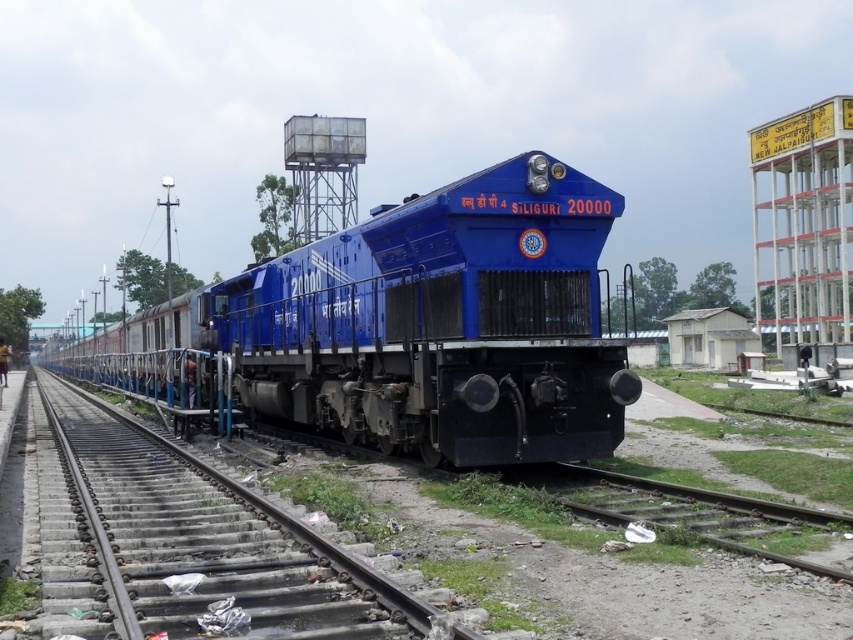
You are a maintenance worker tasked with inspecting the blue metallic locomotive at center and the smooth metal train track at center. The safety protocol requires that the distance between them must be at least 3 meters to ensure safe access. Can you confirm if the current distance meets the safety requirement?

The distance between the blue metallic locomotive at center and the smooth metal train track at center is 4.03 meters, which exceeds the required 3 meters, so it meets the safety requirement.

You are standing at the point marked as point [440,323] in the image. What object are you directly facing?

The point [440,323] indicates the blue metallic locomotive at center, so you are directly facing the blue metallic locomotive at center.

You are a train engineer observing the scene. The gravelly dirt track at lower right and the metallic water tower at upper center are both visible. Which object is closer to the locomotive?

The gravelly dirt track at lower right is closer to the locomotive because it is in front of the metallic water tower at upper center.